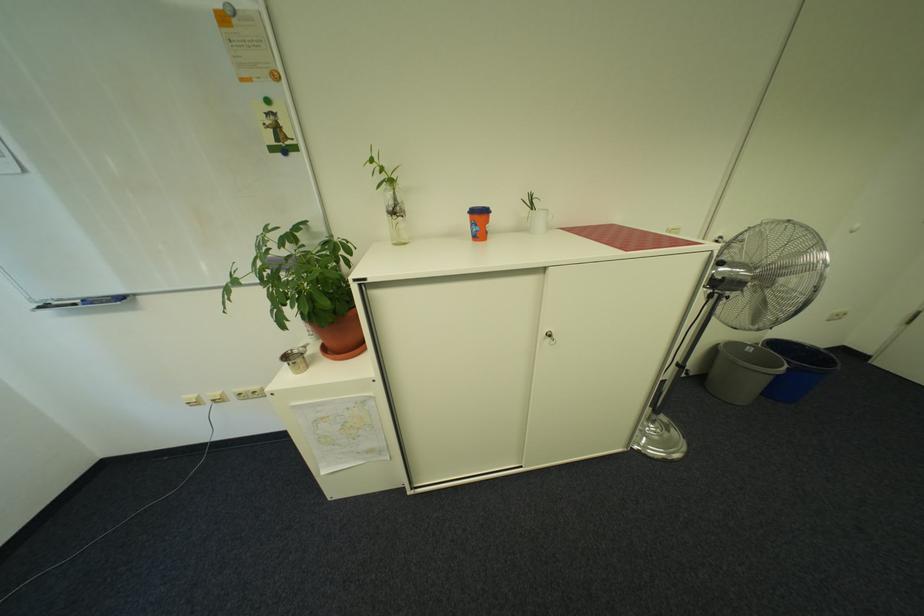
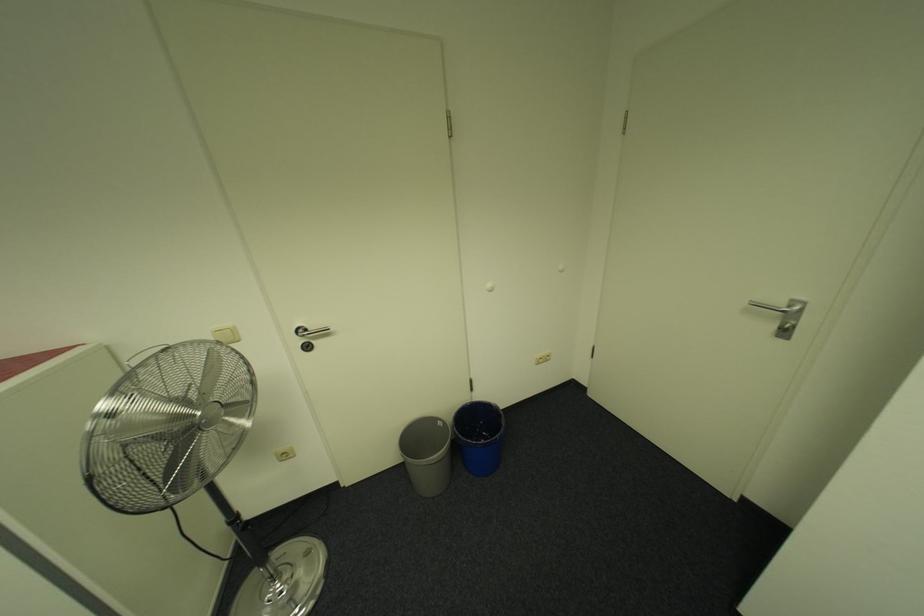
Question: What movement of the cameraman would produce the second image?

Choices:
 (A) Left
 (B) Right
 (C) Forward
 (D) Backward

Answer: (B)